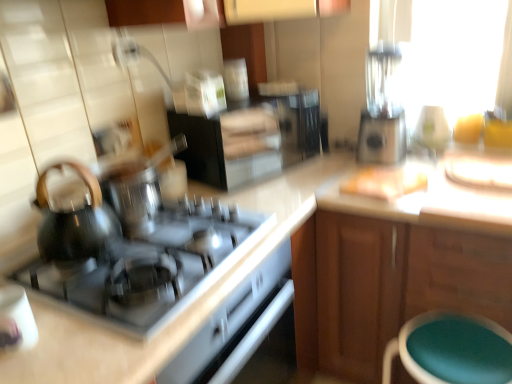
You are a GUI agent. You are given a task and a screenshot of the screen. Output one action in this format:
    pyautogui.click(x=<x>, y=<y>)
    Task: Click on the free point below sleek silver blender at upper right (from a real-world perspective)
    The width and height of the screenshot is (512, 384).
    Given the screenshot: What is the action you would take?
    pyautogui.click(x=386, y=164)